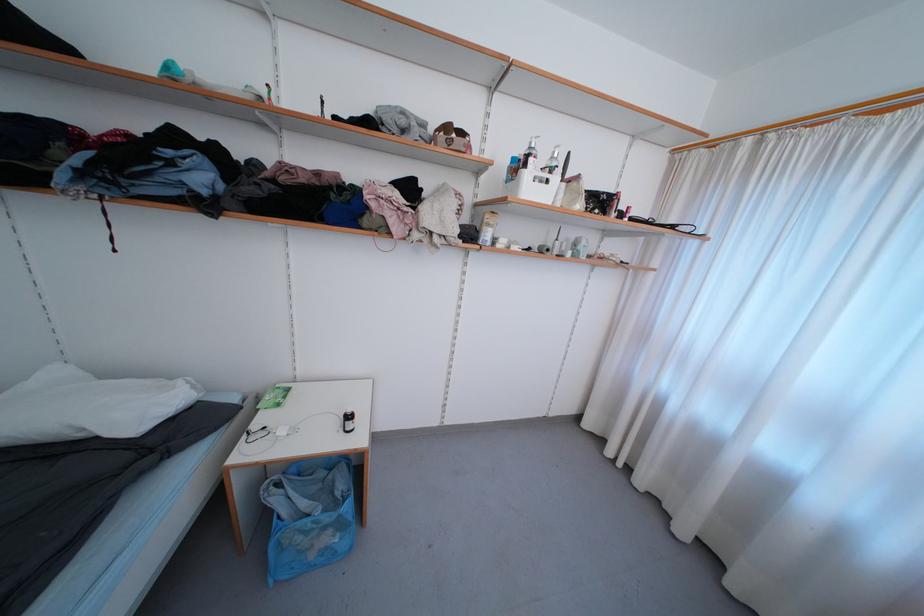
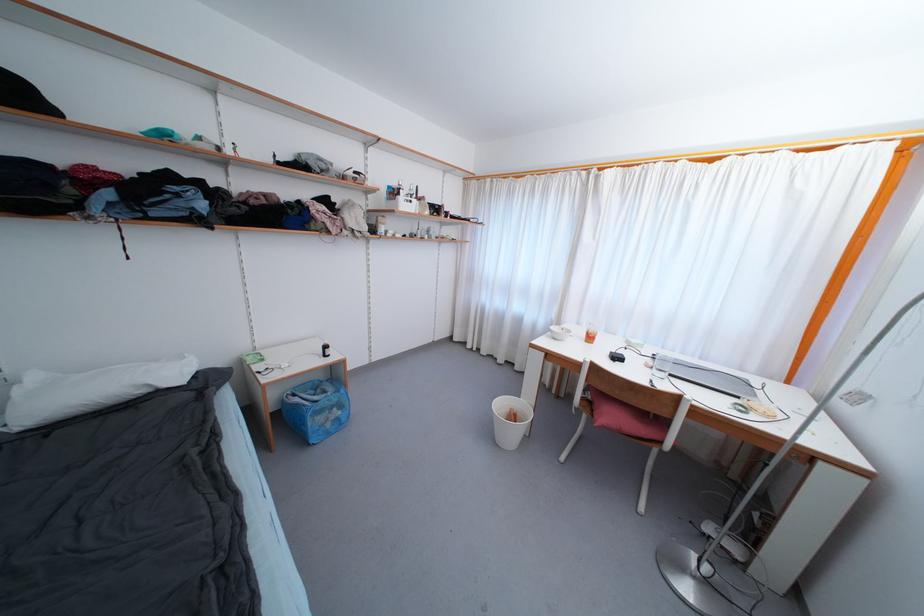
Where in the second image is the point corresponding to (x=284, y=488) from the first image?

(298, 398)